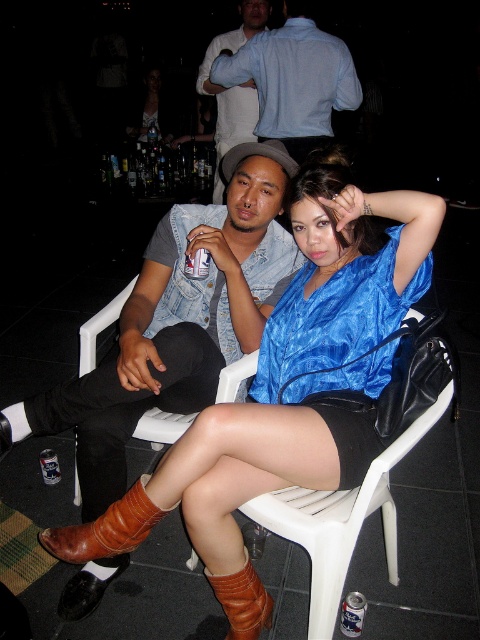
You are a photographer setting up for a photoshoot in a dimly lit bar. You need to ensure that both the velvet blue blouse at center and the matte black dress at center are clearly visible in the frame. Given their positions, which clothing item should you focus on first to ensure proper lighting?

The velvet blue blouse at center is in front of the matte black dress at center, so you should focus on lighting the velvet blue blouse at center first to ensure it is properly illuminated before adjusting for the matte black dress at center.

Looking at this image, in the scene described, there are two people sitting on white plastic chairs. The man on the left is wearing a light denim vest over a dark shirt, and the woman on the right is wearing a blue satin blouse. A point at coordinates point (294, 80) marks the location of the light blue denim shirt at upper center. If you were to draw a straight line from the man on the left to the woman on the right, would this line pass through the point representing the light blue denim shirt at upper center?

The light blue denim shirt at upper center is represented by point (294, 80). Since the man on the left and the woman on the right are seated on white plastic chairs, the straight line between them would likely pass through the upper center area where the shirt is located. Therefore, the line would pass through the point representing the light blue denim shirt at upper center.

What are the coordinates of the velvet blue blouse at center in the image?

The velvet blue blouse at center is located at coordinates point (289, 380).